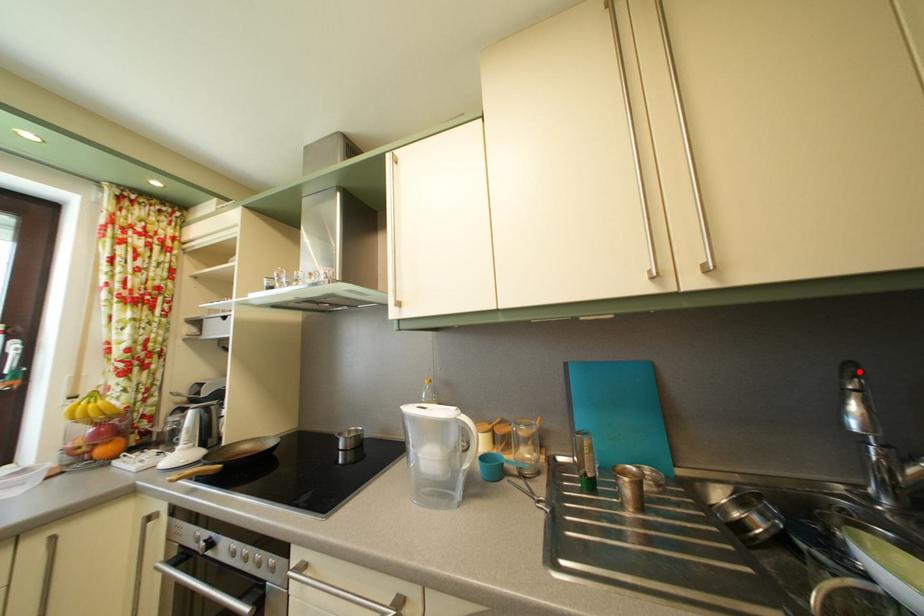
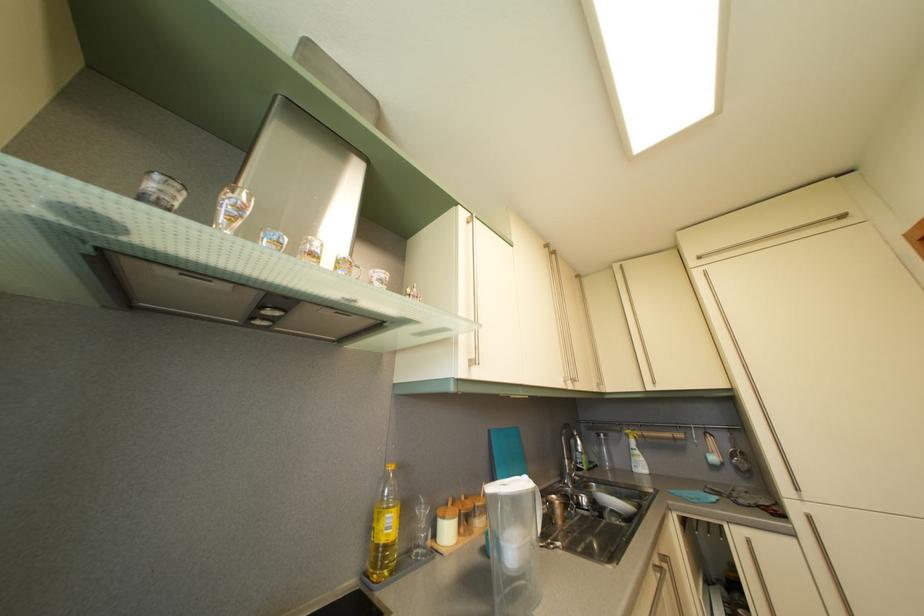
Question: I am providing you with two images of the same scene from different viewpoints. Image1 has a red point marked. In image2, the corresponding 3D location appears at what relative position? Reply with the corresponding letter.

Choices:
 (A) Closer
 (B) Farther

Answer: (B)